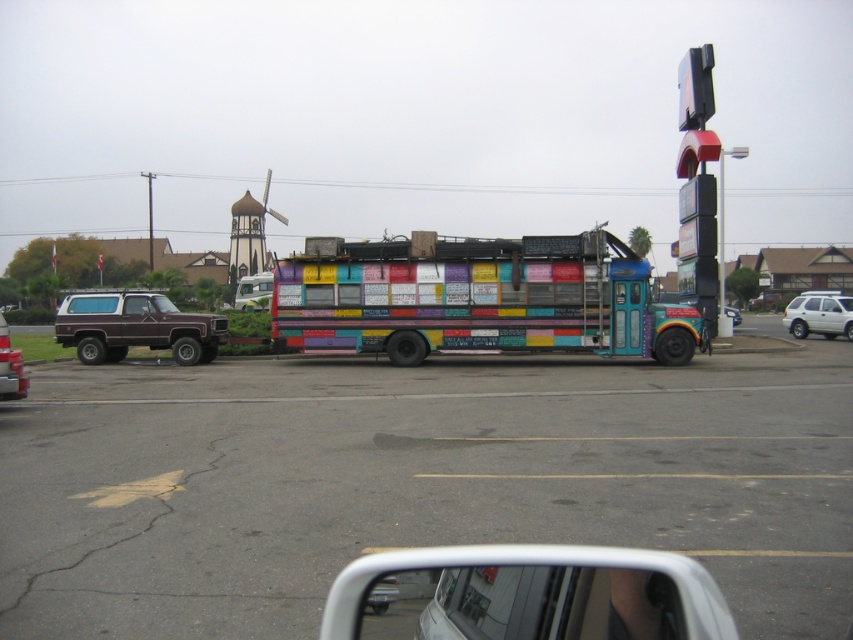
Between point (258, 632) and point (828, 323), which one is positioned in front?

Point (258, 632)

Between multicolored bus at center and white matte car at right, which one appears on the right side from the viewer's perspective?

white matte car at right

Which is in front, point (194, 525) or point (801, 320)?

Point (194, 525) is more forward.

Where is `multicolored bus at center`? The height and width of the screenshot is (640, 853). multicolored bus at center is located at coordinates (415, 481).

Which of these two, multicolored painted bus at center or matte brown suv at left, stands shorter?

matte brown suv at left is shorter.

Where is `multicolored painted bus at center`? multicolored painted bus at center is located at coordinates (476, 298).

This screenshot has width=853, height=640. What do you see at coordinates (415, 481) in the screenshot?
I see `multicolored bus at center` at bounding box center [415, 481].

Who is taller, multicolored bus at center or multicolored painted bus at center?

Standing taller between the two is multicolored painted bus at center.

This screenshot has height=640, width=853. I want to click on multicolored bus at center, so click(x=415, y=481).